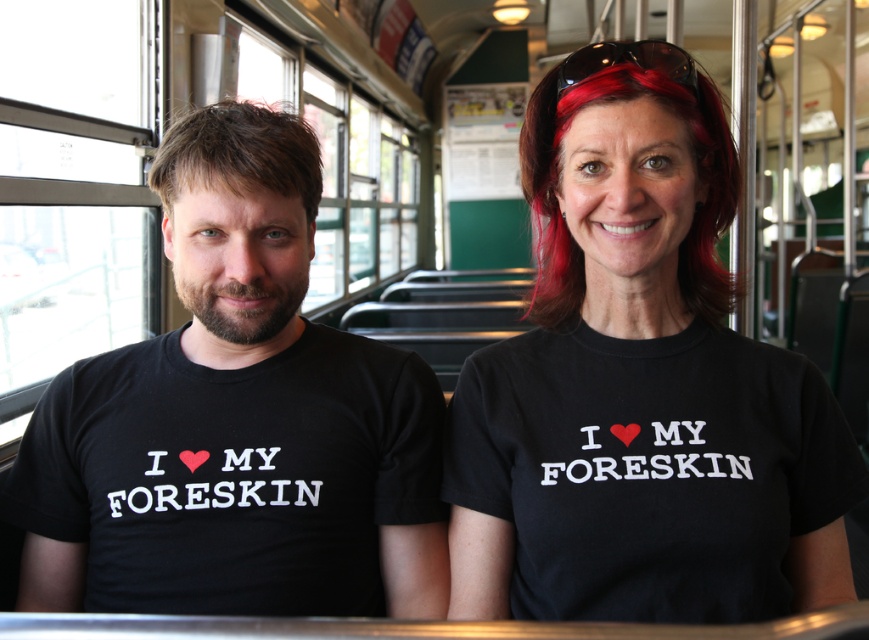
Question: Which point is farther to the camera?

Choices:
 (A) (582, 51)
 (B) (176, 120)

Answer: (B)

Question: Can you confirm if black matte t-shirt at center is thinner than red dyed hair at upper center?

Choices:
 (A) no
 (B) yes

Answer: (A)

Question: Estimate the real-world distances between objects in this image. Which object is farther from the brownhair at center?

Choices:
 (A) red dyed hair at upper center
 (B) black cotton t-shirt at left
 (C) black matte t-shirt at center

Answer: (C)

Question: Is black matte t-shirt at center wider than red dyed hair at upper center?

Choices:
 (A) no
 (B) yes

Answer: (B)

Question: Can you confirm if black matte t-shirt at center is thinner than red dyed hair at upper center?

Choices:
 (A) no
 (B) yes

Answer: (A)

Question: Which point appears closest to the camera in this image?

Choices:
 (A) (216, 164)
 (B) (270, 547)

Answer: (A)